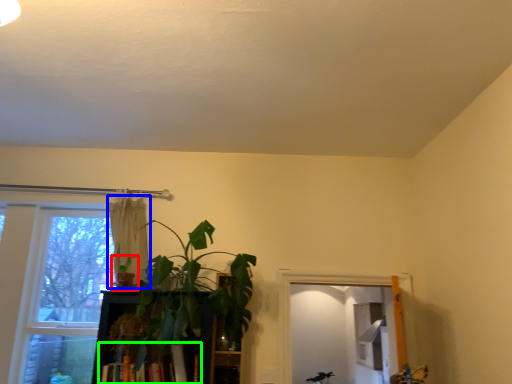
Question: Estimate the real-world distances between objects in this image. Which object is closer to houseplant (highlighted by a red box), curtain (highlighted by a blue box) or book (highlighted by a green box)?

Choices:
 (A) curtain
 (B) book

Answer: (A)